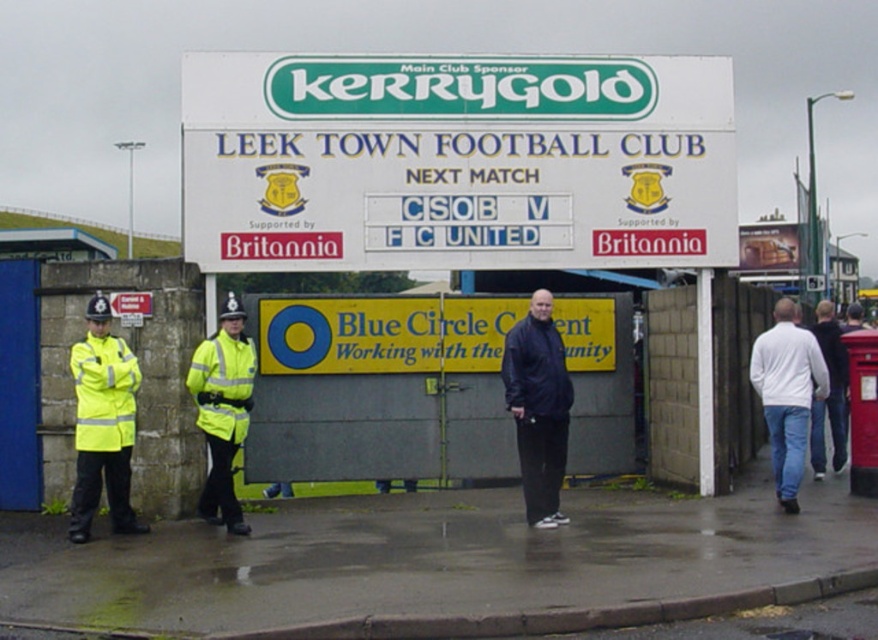
You are at the entrance of Leek Town Football Club and see a black matte jacket at center. Where exactly is the black matte jacket located in relation to the gate?

The black matte jacket at center is located at point (x=538, y=406) relative to the gate.

You are a photographer at Leek Town Football Club entrance. You need to capture a photo of the black matte jacket at center and the white matte shirt at center. Which object should you zoom in on to ensure both are clearly visible without cropping?

The black matte jacket at center has a smaller width than the white matte shirt at center, so you should zoom in on the white matte shirt at center to ensure both objects are fully visible without cropping.